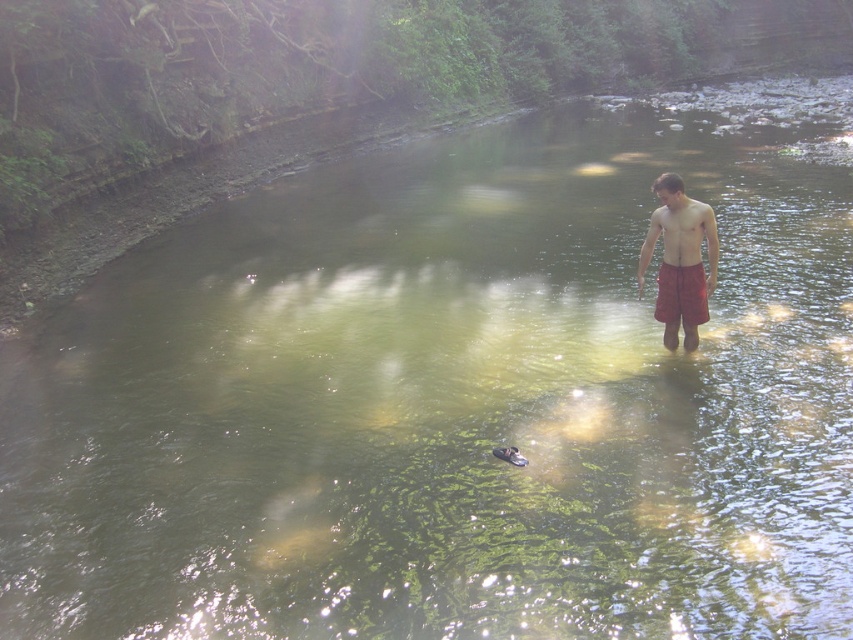
Question: Is matte red shorts at center wider than red cotton shorts at center?

Choices:
 (A) yes
 (B) no

Answer: (A)

Question: Among these objects, which one is nearest to the camera?

Choices:
 (A) matte red shorts at center
 (B) red plaid shorts at right
 (C) red cotton shorts at center

Answer: (B)

Question: Which object is positioned closest to the matte red shorts at center?

Choices:
 (A) red plaid shorts at right
 (B) red cotton shorts at center

Answer: (A)

Question: Is red plaid shorts at right bigger than matte red shorts at center?

Choices:
 (A) yes
 (B) no

Answer: (A)

Question: Which of the following is the farthest from the observer?

Choices:
 (A) (689, 294)
 (B) (695, 221)

Answer: (A)

Question: In this image, where is red plaid shorts at right located relative to matte red shorts at center?

Choices:
 (A) left
 (B) right

Answer: (B)